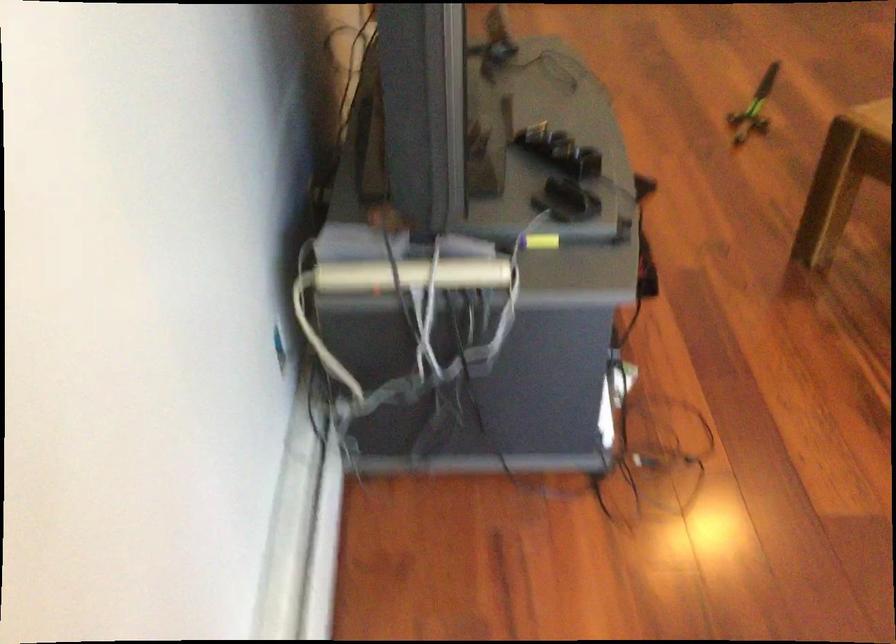
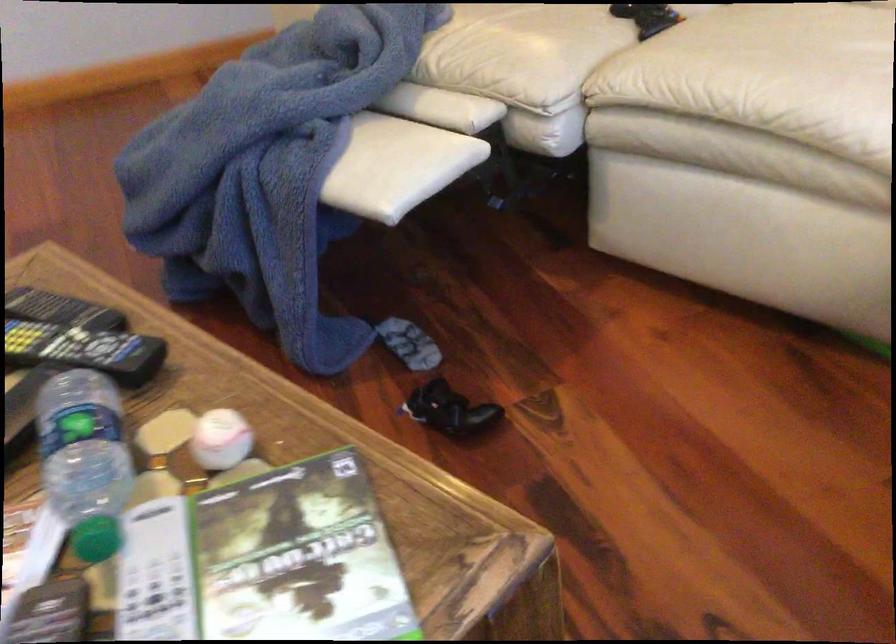
What movement of the cameraman would produce the second image?

The cameraman walked toward right, forward.